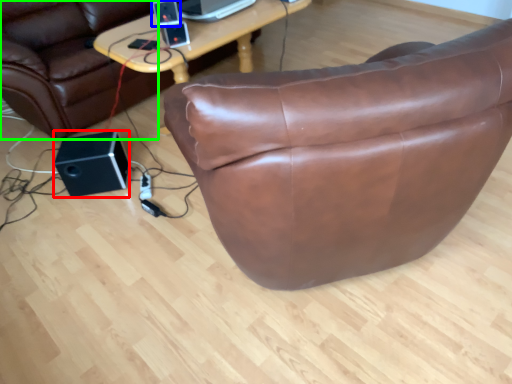
Question: Which object is positioned closest to speaker (highlighted by a red box)? Select from speaker (highlighted by a blue box) and bean bag chair (highlighted by a green box).

Choices:
 (A) speaker
 (B) bean bag chair

Answer: (B)